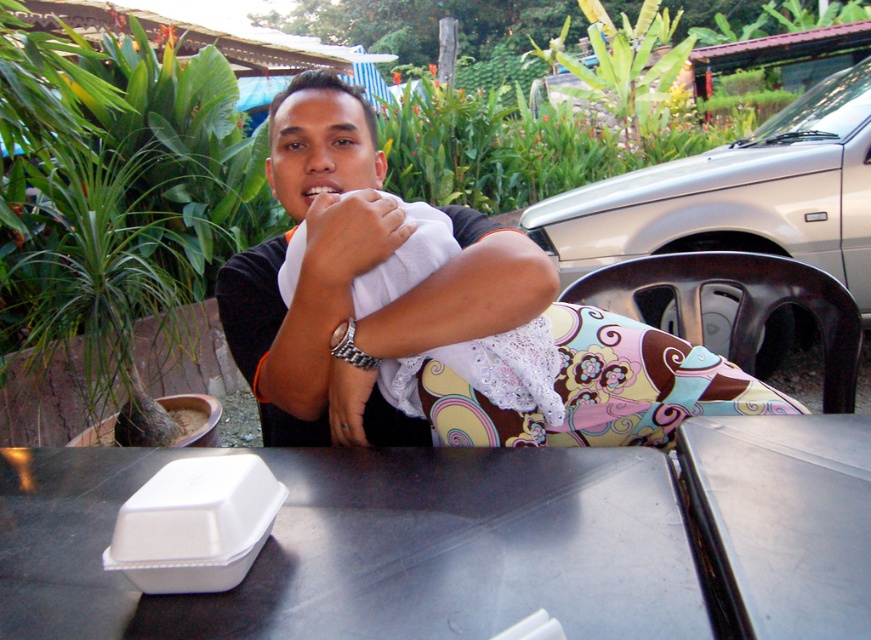
You are a photographer setting up a shoot at the scene described. You need to place a 1.2 meter tall tripod on the metallic silver table at center so it can be seen above the white fabric at center. Is the table tall enough for this?

The metallic silver table at center is taller than the white fabric at center, so placing a 1.2 meter tall tripod on it would allow it to be seen above the white fabric at center.

You are a photographer standing behind the white plastic table at center and the black fabric shirt at center. Which object is closer to you?

The white plastic table at center is closer to you because it is in front of the black fabric shirt at center.